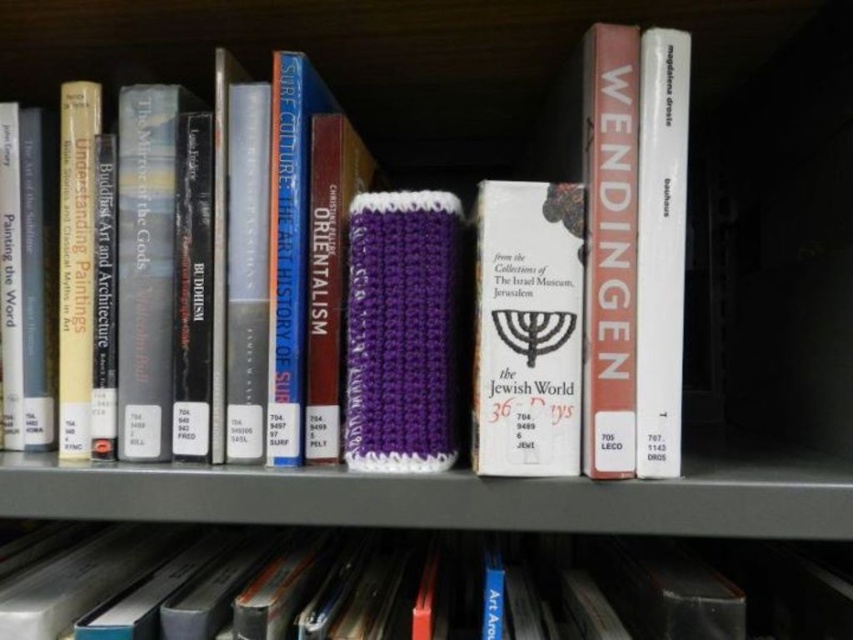
Question: Among these points, which one is farthest from the camera?

Choices:
 (A) (350, 465)
 (B) (546, 333)

Answer: (A)

Question: Which point is closer to the camera taking this photo?

Choices:
 (A) (668, 380)
 (B) (555, 372)

Answer: (B)

Question: Does hardcover book at center have a greater width compared to white paper book at right?

Choices:
 (A) no
 (B) yes

Answer: (B)

Question: Among these objects, which one is farthest from the camera?

Choices:
 (A) matte red book at center
 (B) purple knitted sleeve at center
 (C) hardcover book at center
 (D) white paper book at right

Answer: (B)

Question: Where is hardcover book at center located in relation to matte red book at center in the image?

Choices:
 (A) left
 (B) right

Answer: (A)

Question: Does purple knitted sleeve at center lie in front of matte red book at center?

Choices:
 (A) no
 (B) yes

Answer: (A)